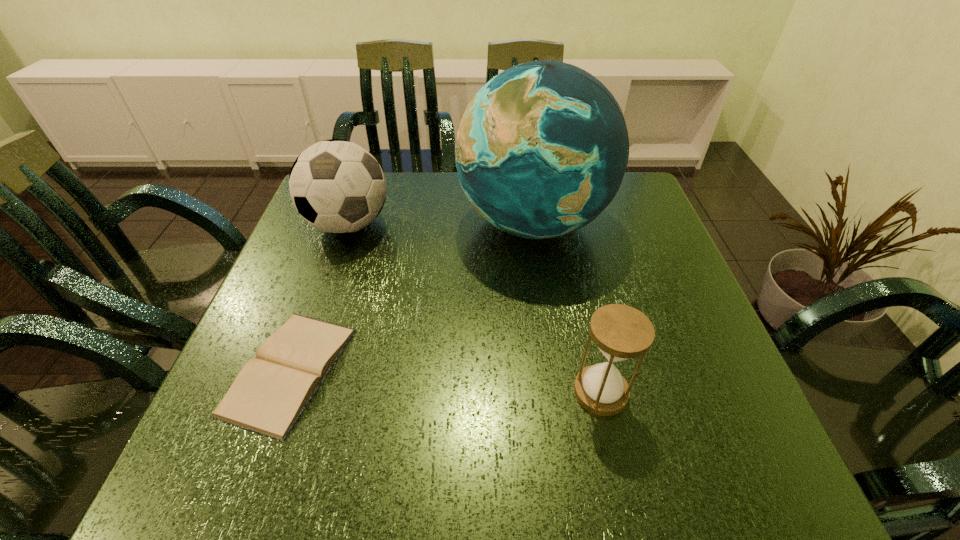
The height and width of the screenshot is (540, 960). Find the location of `vacant space in between the globe and the second tallest object`. vacant space in between the globe and the second tallest object is located at coordinates (441, 224).

You are a GUI agent. You are given a task and a screenshot of the screen. Output one action in this format:
    pyautogui.click(x=<x>, y=<y>)
    Task: Click on the object that stands as the closest to the hourglass
    
    Given the screenshot: What is the action you would take?
    pyautogui.click(x=542, y=148)

Identify which object is the second closest to the globe. Please provide its 2D coordinates. Your answer should be formatted as a tuple, i.e. [(x, y)], where the tuple contains the x and y coordinates of a point satisfying the conditions above.

[(271, 391)]

Identify the location of free space that satisfies the following two spatial constraints: 1. on the front side of the hourglass; 2. on the left side of the Bible. (282, 392).

Image resolution: width=960 pixels, height=540 pixels. What are the coordinates of `vacant region that satisfies the following two spatial constraints: 1. on the main logo of the third tallest object; 2. on the right side of the soccer ball` in the screenshot? It's located at [290, 392].

Identify the location of free space that satisfies the following two spatial constraints: 1. on the front side of the second shortest object; 2. on the left side of the Bible. The image size is (960, 540). (282, 392).